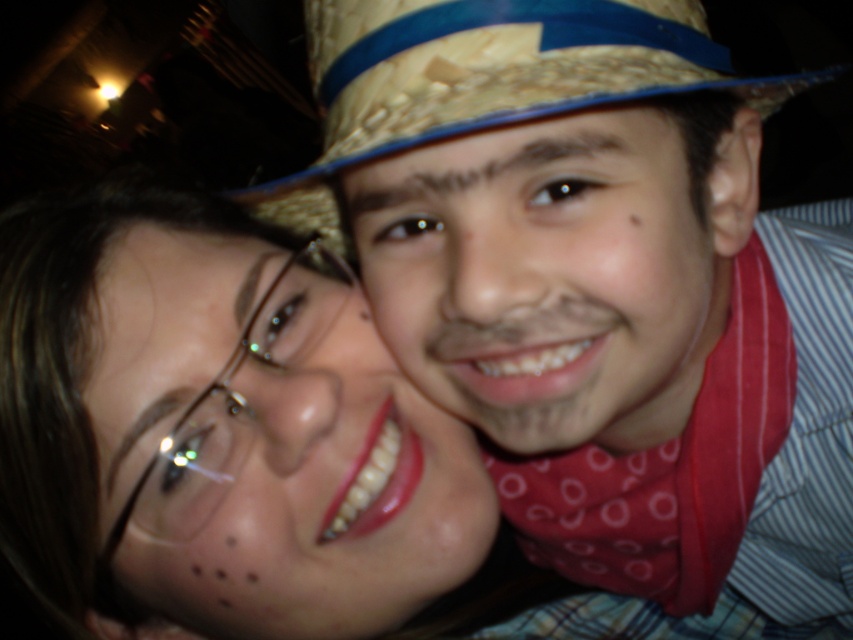
Question: Is straw hat at upper center to the right of strawmaterial/texturecowboy hat at upper center from the viewer's perspective?

Choices:
 (A) yes
 (B) no

Answer: (A)

Question: Which point is closer to the camera?

Choices:
 (A) (705, 24)
 (B) (506, 380)

Answer: (B)

Question: Does matte red bandana at center lie behind strawmaterial/texturecowboy hat at upper center?

Choices:
 (A) yes
 (B) no

Answer: (A)

Question: Based on their relative distances, which object is farther from the matte red bandana at center?

Choices:
 (A) strawmaterial/texturecowboy hat at upper center
 (B) straw hat at upper center

Answer: (A)

Question: Which point is closer to the camera taking this photo?

Choices:
 (A) (544, 212)
 (B) (837, 234)
 (C) (683, 16)
 (D) (352, 586)

Answer: (A)

Question: Is matte glass face at center closer to camera compared to matte red bandana at center?

Choices:
 (A) no
 (B) yes

Answer: (A)